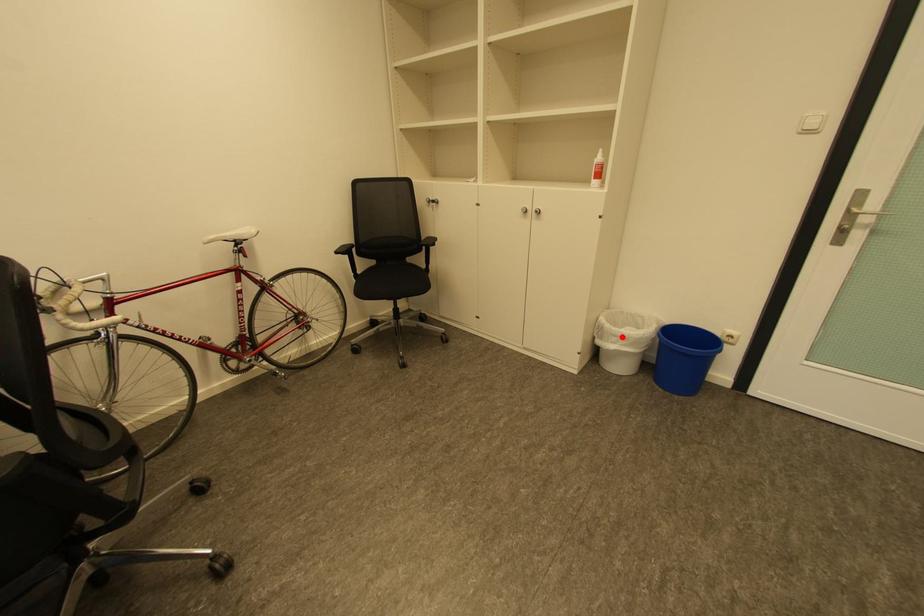
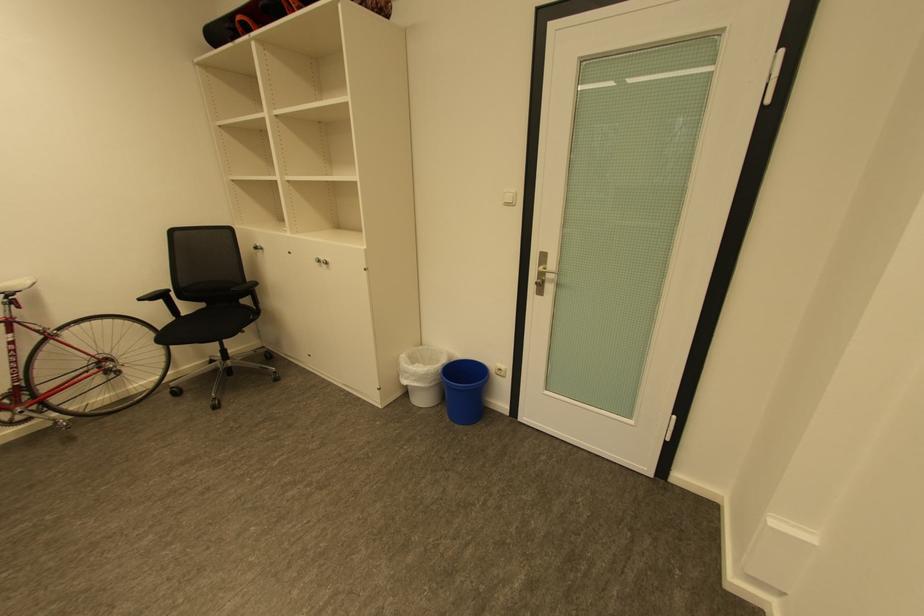
Locate, in the second image, the point that corresponds to the highlighted location in the first image.

(414, 373)